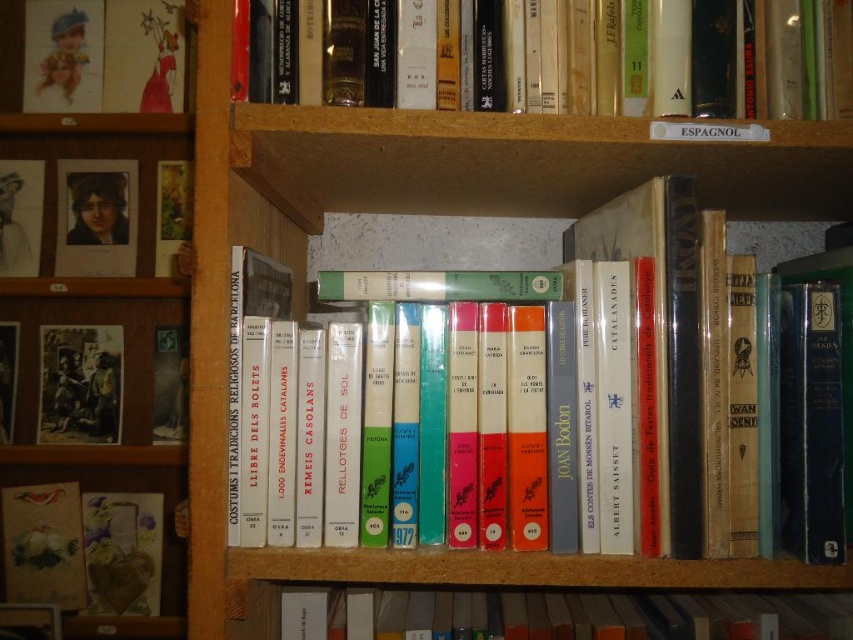
You are standing in front of a bookshelf and want to reach a point marked at coordinates (750, 116). If your arm can extend 24 inches, can you comfortably reach that point?

The distance of point (750, 116) from the camera is 28.20 inches. Since your arm can only extend 24 inches, you cannot comfortably reach that point.

You are organizing books on the wooden bookshelf at center and want to place the hardcover book at upper center. Can you fit it vertically on the shelf?

The hardcover book at upper center is shorter than the wooden bookshelf at center, so it can be placed vertically on the shelf.

Looking at this image, you are organizing a library and need to place a new book between the hardcover book at upper center and the hardcover book at center. Where should the new book be placed in relation to these two books?

The new book should be placed between the hardcover book at upper center and the hardcover book at center, which means it should be positioned below the hardcover book at upper center and above the hardcover book at center since the upper center book is above the center one.